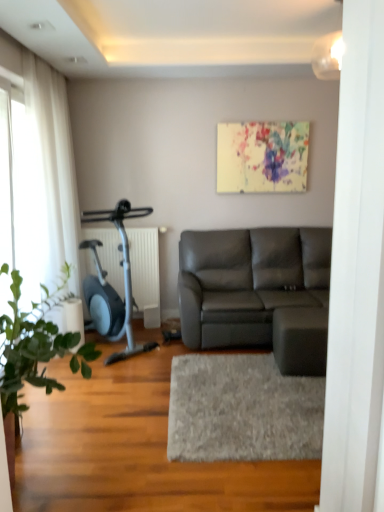
The image size is (384, 512). I want to click on matte gray leather couch at center, so click(x=258, y=292).

What do you see at coordinates (16, 196) in the screenshot?
I see `transparent glass door at left` at bounding box center [16, 196].

Find the location of a particular element. matte gray leather couch at center is located at coordinates (258, 292).

Between point (194, 408) and point (87, 283), which one is positioned in front?

Positioned in front is point (194, 408).

How distant is white shaggy rug at center from metallic blue stationary bicycle at left?

white shaggy rug at center and metallic blue stationary bicycle at left are 1.12 meters apart.

Considering the sizes of objects white shaggy rug at center and metallic blue stationary bicycle at left in the image provided, who is smaller, white shaggy rug at center or metallic blue stationary bicycle at left?

white shaggy rug at center.

Is white shaggy rug at center taller than metallic blue stationary bicycle at left?

In fact, white shaggy rug at center may be shorter than metallic blue stationary bicycle at left.

Between matte gray leather couch at center and white sheer curtain at left, which one is positioned behind?

white sheer curtain at left is more distant.

Where is `studio couch in front of the white sheer curtain at left`? The width and height of the screenshot is (384, 512). studio couch in front of the white sheer curtain at left is located at coordinates (258, 292).

Between point (305, 293) and point (64, 259), which one is positioned in front?

Positioned in front is point (64, 259).

Is green leafy plant at left situated inside metallic blue stationary bicycle at left or outside?

green leafy plant at left is located beyond the bounds of metallic blue stationary bicycle at left.

Considering the points (15, 289) and (109, 321), which point is in front, point (15, 289) or point (109, 321)?

The point (15, 289) is in front.

Does green leafy plant at left have a larger size compared to metallic blue stationary bicycle at left?

No, green leafy plant at left is not bigger than metallic blue stationary bicycle at left.

Between white sheer curtain at left and transparent glass door at left, which one is positioned behind?

white sheer curtain at left is further away from the camera.

Which of these two, white sheer curtain at left or transparent glass door at left, stands shorter?

With less height is transparent glass door at left.

Where is `curtain that is above the transparent glass door at left (from the image's perspective)`? curtain that is above the transparent glass door at left (from the image's perspective) is located at coordinates (52, 172).

Looking at the image, does white sheer curtain at left seem bigger or smaller compared to transparent glass door at left?

Clearly, white sheer curtain at left is larger in size than transparent glass door at left.

How many degrees apart are the facing directions of matte gray leather couch at center and white shaggy rug at center?

The angle between the facing direction of matte gray leather couch at center and the facing direction of white shaggy rug at center is 3.64 degrees.

Between matte gray leather couch at center and white shaggy rug at center, which one appears on the left side from the viewer's perspective?

white shaggy rug at center is more to the left.

Is matte gray leather couch at center not inside white shaggy rug at center?

matte gray leather couch at center is positioned outside white shaggy rug at center.

Which object is positioned more to the left, green leafy plant at left or transparent glass door at left?

From the viewer's perspective, transparent glass door at left appears more on the left side.

Find the location of a particular element. The height and width of the screenshot is (512, 384). glass door on the left side of green leafy plant at left is located at coordinates (16, 196).

Are green leafy plant at left and transparent glass door at left far apart?

Yes, green leafy plant at left and transparent glass door at left are located far from each other.

Between white shaggy rug at center and white sheer curtain at left, which one has more height?

Standing taller between the two is white sheer curtain at left.

Based on the photo, is white shaggy rug at center facing away from white sheer curtain at left?

white shaggy rug at center is not turned away from white sheer curtain at left.

Is white shaggy rug at center in front of or behind white sheer curtain at left in the image?

Visually, white shaggy rug at center is located in front of white sheer curtain at left.

Identify the location of flat to the right of white sheer curtain at left. (242, 410).

Identify the location of stationary bicycle above the white shaggy rug at center (from a real-world perspective). (124, 285).

This screenshot has width=384, height=512. Find the location of `curtain to the left of matte gray leather couch at center`. curtain to the left of matte gray leather couch at center is located at coordinates (52, 172).

Estimate the real-world distances between objects in this image. Which object is further from green leafy plant at left, white shaggy rug at center or matte gray leather couch at center?

Among the two, matte gray leather couch at center is located further to green leafy plant at left.

Based on their spatial positions, is green leafy plant at left or transparent glass door at left closer to white sheer curtain at left?

transparent glass door at left lies closer to white sheer curtain at left than the other object.

Based on their spatial positions, is transparent glass door at left or matte gray leather couch at center closer to green leafy plant at left?

transparent glass door at left is closer to green leafy plant at left.

Considering their positions, is matte gray leather couch at center positioned closer to metallic blue stationary bicycle at left than white shaggy rug at center?

matte gray leather couch at center.

From the image, which object appears to be nearer to matte gray leather couch at center, white sheer curtain at left or transparent glass door at left?

white sheer curtain at left is positioned closer to the anchor matte gray leather couch at center.

Looking at this image, based on their spatial positions, is white shaggy rug at center or matte gray leather couch at center closer to transparent glass door at left?

white shaggy rug at center is positioned closer to the anchor transparent glass door at left.

Based on their spatial positions, is matte gray leather couch at center or green leafy plant at left closer to metallic blue stationary bicycle at left?

matte gray leather couch at center is closer to metallic blue stationary bicycle at left.

Considering their positions, is green leafy plant at left positioned further to transparent glass door at left than metallic blue stationary bicycle at left?

The object further to transparent glass door at left is green leafy plant at left.

You are a GUI agent. You are given a task and a screenshot of the screen. Output one action in this format:
    pyautogui.click(x=<x>, y=<y>)
    Task: Click on the houseplant located between white sheer curtain at left and white shaggy rug at center in the left-right direction
    The image size is (384, 512).
    Given the screenshot: What is the action you would take?
    pyautogui.click(x=30, y=346)

Where is `stationary bicycle between green leafy plant at left and white sheer curtain at left from front to back`? Image resolution: width=384 pixels, height=512 pixels. stationary bicycle between green leafy plant at left and white sheer curtain at left from front to back is located at coordinates (124, 285).

What are the coordinates of `glass door between white sheer curtain at left and metallic blue stationary bicycle at left vertically` in the screenshot? It's located at (16, 196).

What are the coordinates of `glass door between green leafy plant at left and metallic blue stationary bicycle at left in the front-back direction` in the screenshot? It's located at (16, 196).